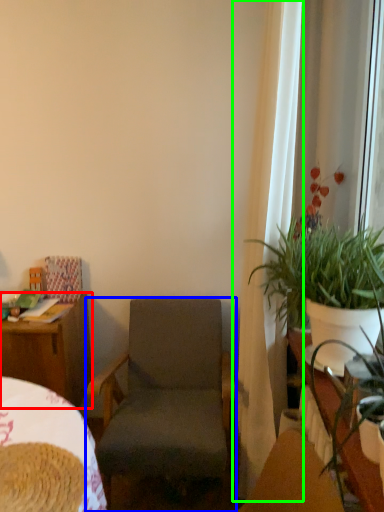
Question: Which is nearer to the desk (highlighted by a red box)? chair (highlighted by a blue box) or curtain (highlighted by a green box).

Choices:
 (A) chair
 (B) curtain

Answer: (A)